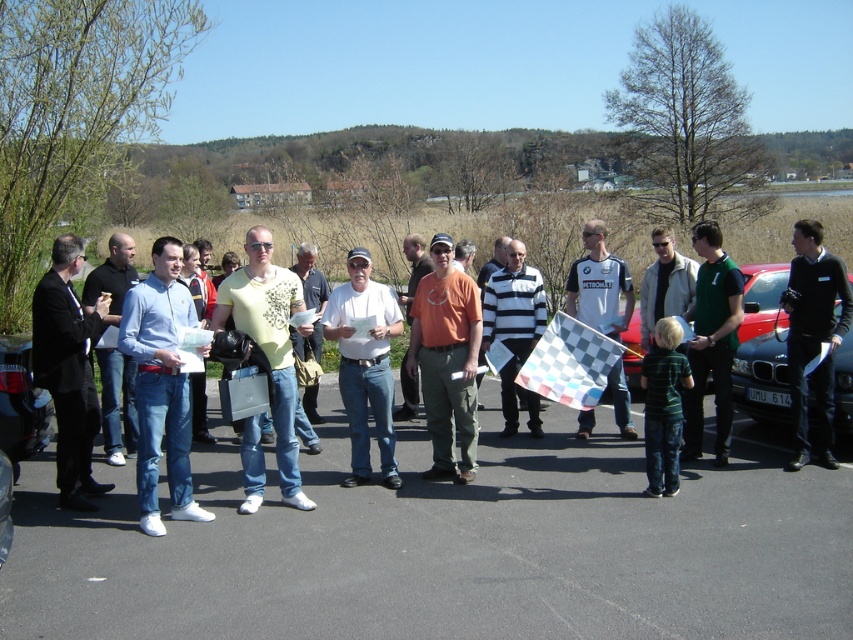
Does point (4, 355) lie in front of point (668, 294)?

Yes.

This screenshot has width=853, height=640. What do you see at coordinates (21, 403) in the screenshot? I see `metallic silver car at left` at bounding box center [21, 403].

Locate an element on the screen. The image size is (853, 640). metallic silver car at left is located at coordinates (21, 403).

Does orange cotton t-shirt at center have a lesser width compared to matte gray shirt at center?

Incorrect, orange cotton t-shirt at center's width is not less than matte gray shirt at center's.

Can you confirm if orange cotton t-shirt at center is positioned above matte gray shirt at center?

Incorrect, orange cotton t-shirt at center is not positioned above matte gray shirt at center.

Is point (438, 353) positioned in front of point (695, 276)?

Yes, point (438, 353) is in front of point (695, 276).

This screenshot has width=853, height=640. I want to click on orange cotton t-shirt at center, so click(445, 358).

Is black suit jacket at left to the left of matte gray shirt at center from the viewer's perspective?

Yes, black suit jacket at left is to the left of matte gray shirt at center.

Does black suit jacket at left have a larger size compared to matte gray shirt at center?

Indeed, black suit jacket at left has a larger size compared to matte gray shirt at center.

Describe the element at coordinates (68, 369) in the screenshot. The image size is (853, 640). I see `black suit jacket at left` at that location.

Locate an element on the screen. The image size is (853, 640). black suit jacket at left is located at coordinates (68, 369).